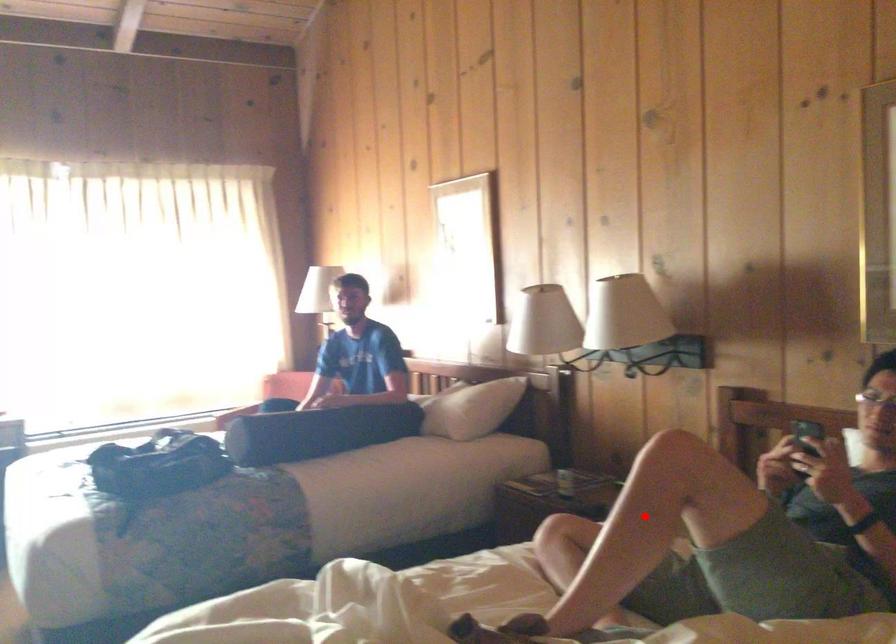
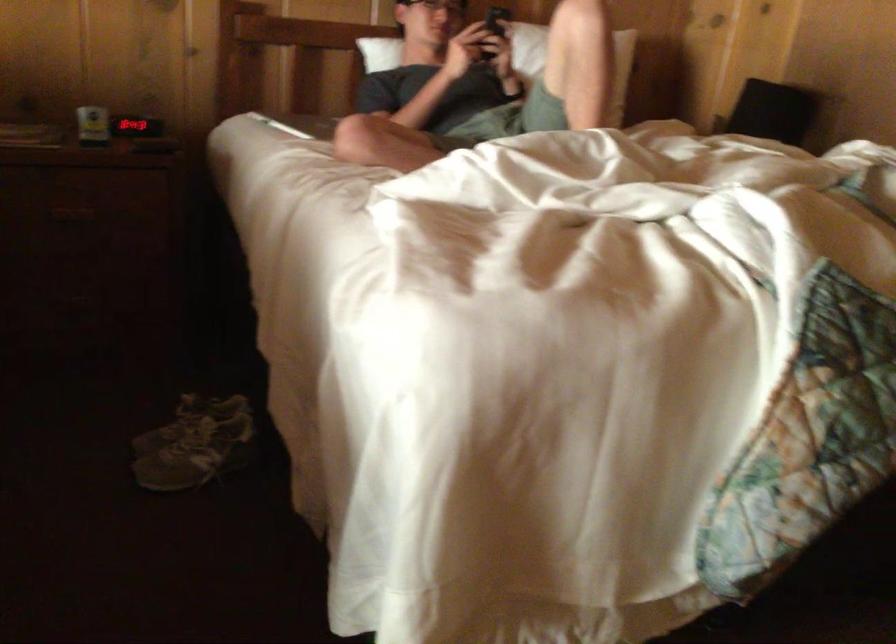
Question: I am providing you with two images of the same scene from different viewpoints. A red point is shown in image1. For the corresponding object point in image2, is it positioned nearer or farther from the camera?

Choices:
 (A) Nearer
 (B) Farther

Answer: (B)